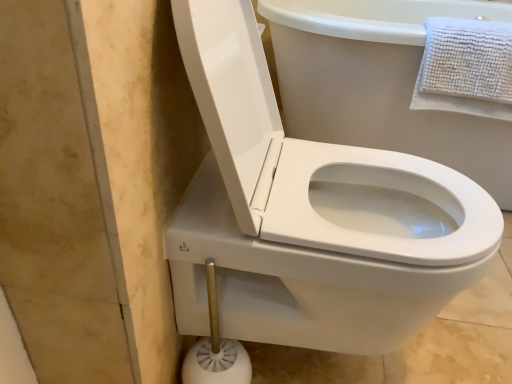
Question: From a real-world perspective, is white plastic toilet brush at lower center located higher than white textured towel at upper right?

Choices:
 (A) yes
 (B) no

Answer: (B)

Question: Is white plastic toilet brush at lower center at the left side of white textured towel at upper right?

Choices:
 (A) no
 (B) yes

Answer: (B)

Question: Is white plastic toilet brush at lower center bigger than white textured towel at upper right?

Choices:
 (A) yes
 (B) no

Answer: (B)

Question: Is white plastic toilet brush at lower center facing away from white textured towel at upper right?

Choices:
 (A) no
 (B) yes

Answer: (A)

Question: Considering the relative sizes of white plastic toilet brush at lower center and white textured towel at upper right in the image provided, is white plastic toilet brush at lower center wider than white textured towel at upper right?

Choices:
 (A) no
 (B) yes

Answer: (A)

Question: Relative to white textured towel at upper right, is white plastic toilet brush at lower center in front or behind?

Choices:
 (A) front
 (B) behind

Answer: (A)

Question: From the image's perspective, is white plastic toilet brush at lower center above or below white textured towel at upper right?

Choices:
 (A) above
 (B) below

Answer: (B)

Question: Is white plastic toilet brush at lower center wider or thinner than white textured towel at upper right?

Choices:
 (A) wide
 (B) thin

Answer: (B)

Question: Considering the positions of white plastic toilet brush at lower center and white textured towel at upper right in the image, is white plastic toilet brush at lower center bigger or smaller than white textured towel at upper right?

Choices:
 (A) small
 (B) big

Answer: (A)

Question: Considering the relative positions of white plastic toilet brush at lower center and white glossy toilet at center in the image provided, is white plastic toilet brush at lower center to the left or to the right of white glossy toilet at center?

Choices:
 (A) right
 (B) left

Answer: (B)

Question: Is point (211, 264) closer or farther from the camera than point (481, 228)?

Choices:
 (A) farther
 (B) closer

Answer: (B)

Question: From a real-world perspective, is white plastic toilet brush at lower center positioned above or below white glossy toilet at center?

Choices:
 (A) above
 (B) below

Answer: (B)

Question: Is white plastic toilet brush at lower center inside or outside of white glossy toilet at center?

Choices:
 (A) inside
 (B) outside

Answer: (A)

Question: In the image, is white glossy toilet at center positioned in front of or behind white textured towel at upper right?

Choices:
 (A) behind
 (B) front

Answer: (B)

Question: From a real-world perspective, is white glossy toilet at center above or below white textured towel at upper right?

Choices:
 (A) below
 (B) above

Answer: (A)